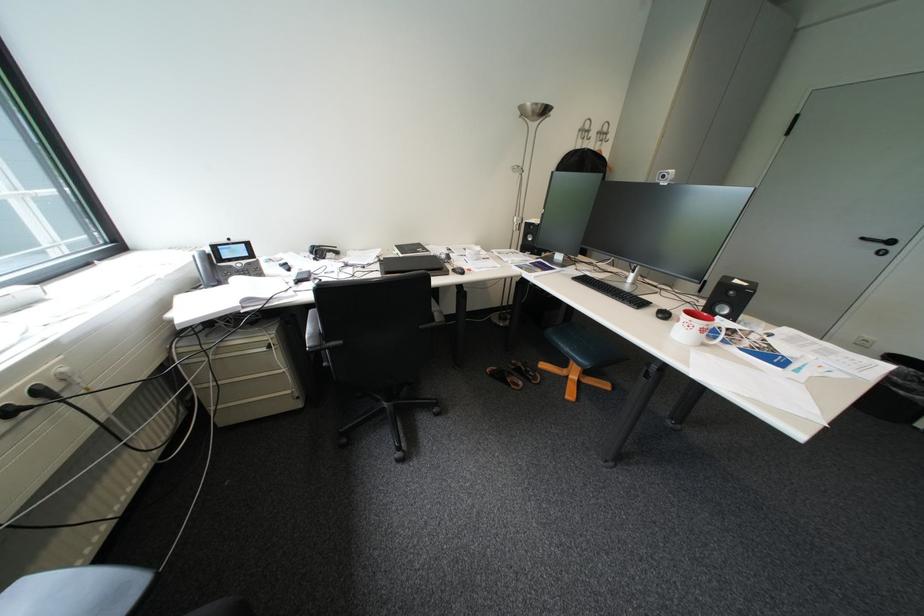
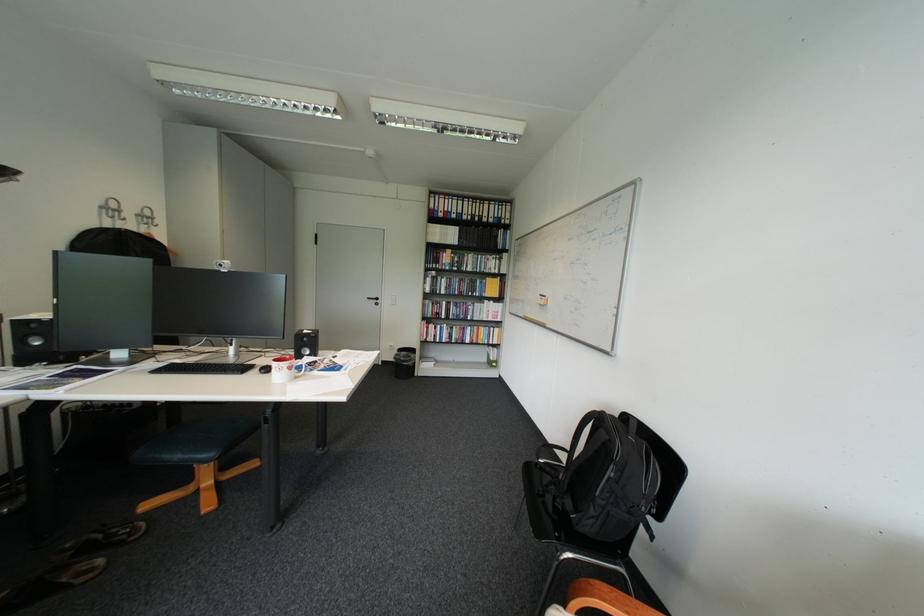
Find the pixel in the second image that matches the point at 591,131 in the first image.

(114, 208)